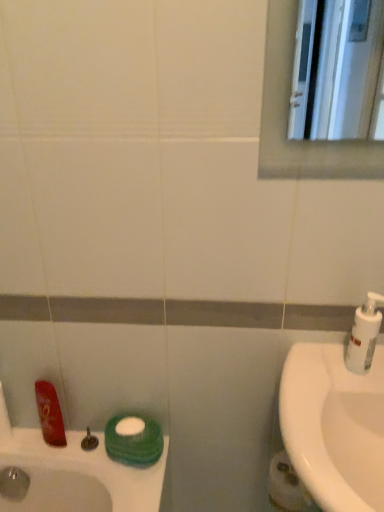
Question: Are white matte toilet paper at lower right and matte silver faucet at lower left located far from each other?

Choices:
 (A) no
 (B) yes

Answer: (A)

Question: Is white matte toilet paper at lower right located outside matte silver faucet at lower left?

Choices:
 (A) no
 (B) yes

Answer: (B)

Question: From the image's perspective, does white matte toilet paper at lower right appear lower than matte silver faucet at lower left?

Choices:
 (A) no
 (B) yes

Answer: (B)

Question: Is white matte toilet paper at lower right to the right of matte silver faucet at lower left from the viewer's perspective?

Choices:
 (A) yes
 (B) no

Answer: (A)

Question: Is white matte toilet paper at lower right positioned behind matte silver faucet at lower left?

Choices:
 (A) no
 (B) yes

Answer: (A)

Question: Is white matte toilet paper at lower right next to matte silver faucet at lower left?

Choices:
 (A) yes
 (B) no

Answer: (B)

Question: Is white plastic soap dispenser at right smaller than white matte toilet paper at lower right?

Choices:
 (A) no
 (B) yes

Answer: (B)

Question: Is white plastic soap dispenser at right to the left of white matte toilet paper at lower right from the viewer's perspective?

Choices:
 (A) yes
 (B) no

Answer: (B)

Question: Could white matte toilet paper at lower right be considered to be inside white plastic soap dispenser at right?

Choices:
 (A) no
 (B) yes

Answer: (A)

Question: Is white plastic soap dispenser at right far away from white matte toilet paper at lower right?

Choices:
 (A) no
 (B) yes

Answer: (A)

Question: Does white plastic soap dispenser at right have a larger size compared to white matte toilet paper at lower right?

Choices:
 (A) no
 (B) yes

Answer: (A)

Question: Does white plastic soap dispenser at right have a greater width compared to white matte toilet paper at lower right?

Choices:
 (A) yes
 (B) no

Answer: (B)

Question: Considering the relative sizes of white glossy sink at right and white matte toilet paper at lower right in the image provided, is white glossy sink at right bigger than white matte toilet paper at lower right?

Choices:
 (A) yes
 (B) no

Answer: (A)